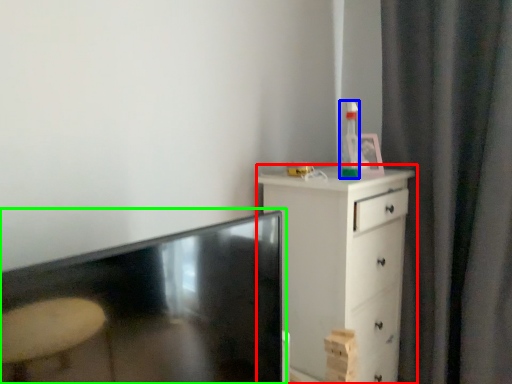
Question: Based on their relative distances, which object is nearer to chest of drawers (highlighted by a red box)? Choose from bottle (highlighted by a blue box) and table (highlighted by a green box).

Choices:
 (A) bottle
 (B) table

Answer: (A)